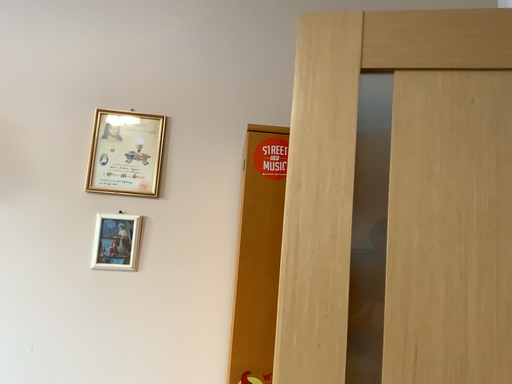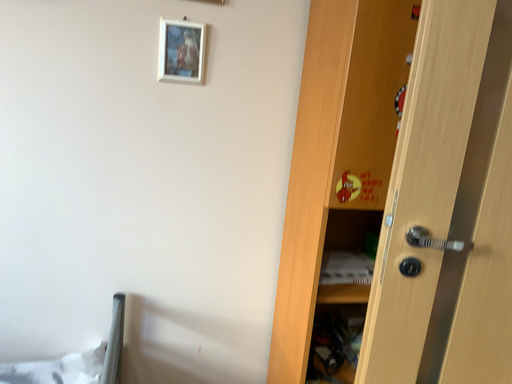
Question: How did the camera likely rotate when shooting the video?

Choices:
 (A) rotated left
 (B) rotated right

Answer: (B)